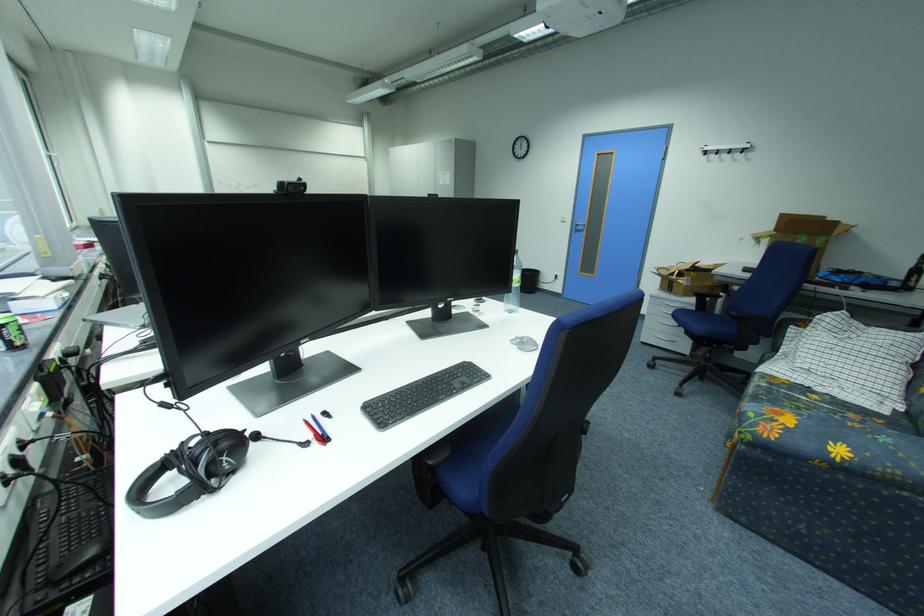
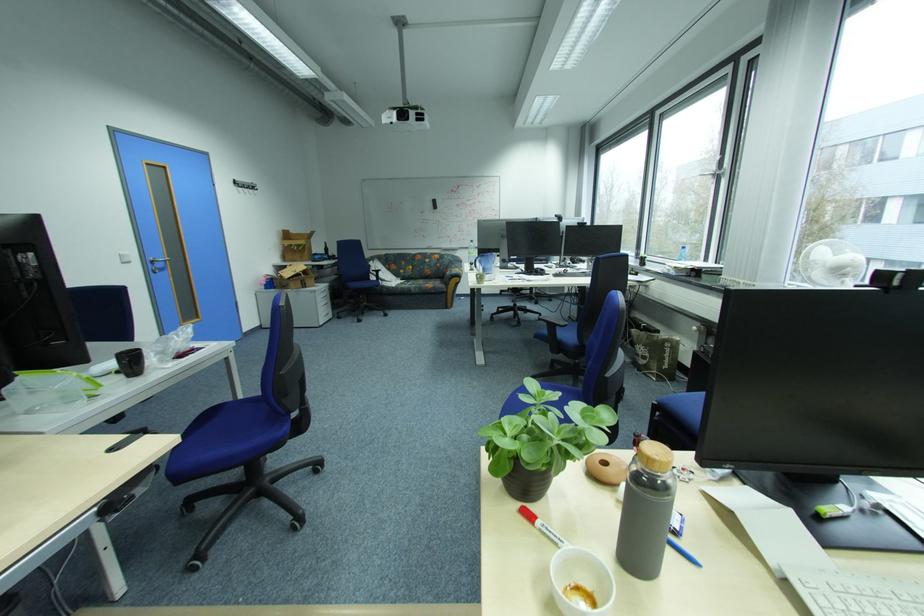
In the second image, find the point that corresponds to the point at 570,217 in the first image.

(130, 254)